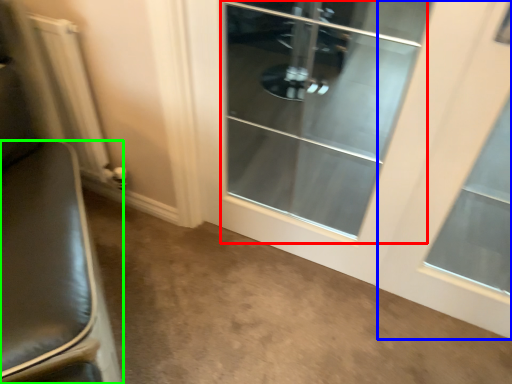
Question: Which object is the closest to the screen door (highlighted by a red box)? Choose among these: window (highlighted by a blue box) or furniture (highlighted by a green box).

Choices:
 (A) window
 (B) furniture

Answer: (A)